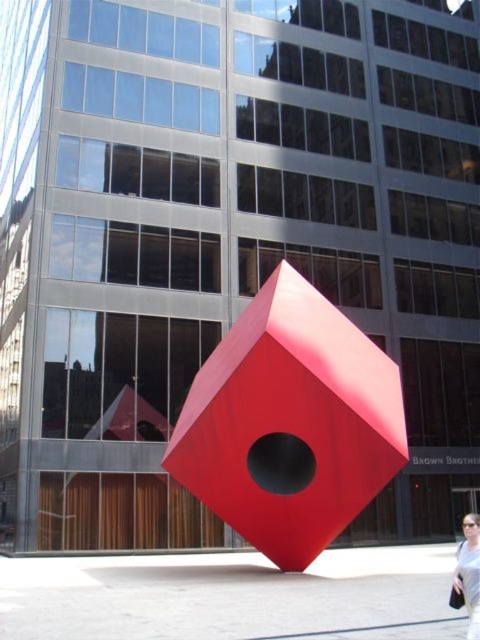
Question: Which point is farther from the camera taking this photo?

Choices:
 (A) (289, 404)
 (B) (463, 529)

Answer: (B)

Question: Observing the image, what is the correct spatial positioning of matte red cube at center in reference to matte black sunglasses at lower right?

Choices:
 (A) right
 (B) left

Answer: (B)

Question: Which point is closer to the camera taking this photo?

Choices:
 (A) (277, 532)
 (B) (479, 563)

Answer: (B)

Question: From the image, what is the correct spatial relationship of matte red cube at center in relation to matte black sunglasses at lower right?

Choices:
 (A) left
 (B) right

Answer: (A)

Question: Where is matte red cube at center located in relation to matte black sunglasses at lower right in the image?

Choices:
 (A) below
 (B) above

Answer: (B)